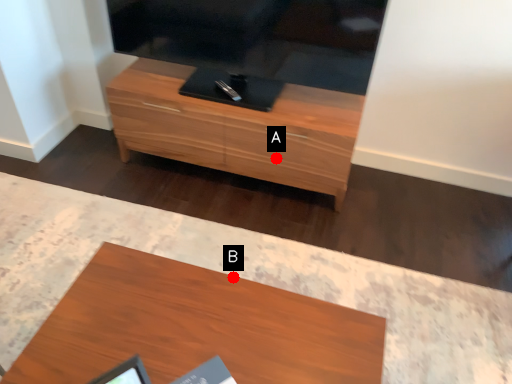
Question: Two points are circled on the image, labeled by A and B beside each circle. Which point is farther from the camera taking this photo?

Choices:
 (A) A is further
 (B) B is further

Answer: (A)